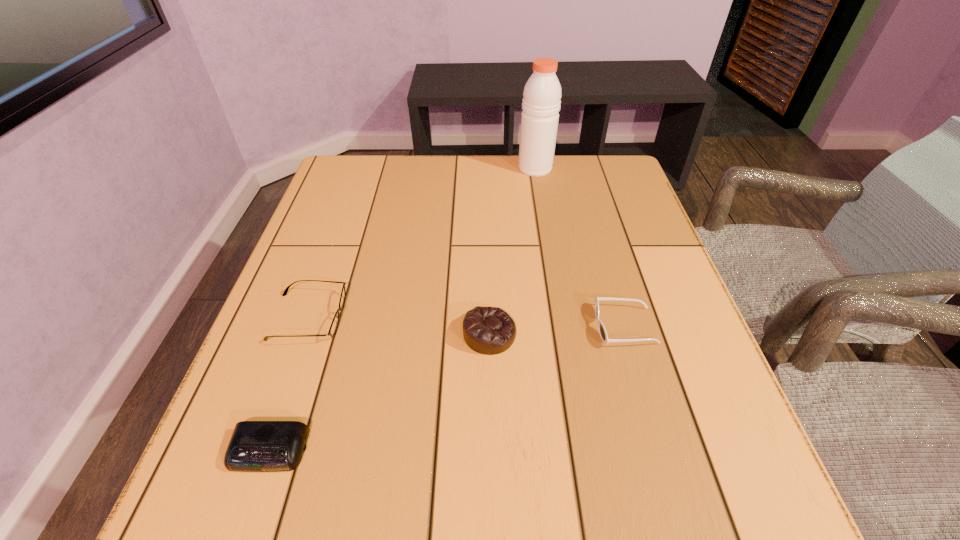
Identify the location of free location located 0.350m with the lenses of the sunglasses facing outward. (418, 326).

I want to click on free space located with the lenses of the sunglasses facing outward, so click(x=484, y=326).

At what (x,y) coordinates should I click in order to perform the action: click on free region located 0.180m on the front-facing side of the spectacles. Please return your answer as a coordinate pair (x, y). This screenshot has height=540, width=960. Looking at the image, I should click on (433, 317).

Locate an element on the screen. object that is at the far edge is located at coordinates tap(541, 100).

Find the location of a particular element. This screenshot has width=960, height=540. object positioned at the near edge is located at coordinates (255, 446).

Image resolution: width=960 pixels, height=540 pixels. In order to click on spectacles that is positioned at the left edge in this screenshot , I will do `click(335, 322)`.

Identify the location of alarm clock present at the left edge. (255, 446).

I want to click on object that is at the right edge, so click(x=602, y=331).

Locate an element on the screen. The width and height of the screenshot is (960, 540). object present at the near left corner is located at coordinates [x=255, y=446].

You are a GUI agent. You are given a task and a screenshot of the screen. Output one action in this format:
    pyautogui.click(x=<x>, y=<y>)
    Task: Click on the blank space at the far edge
    
    Given the screenshot: What is the action you would take?
    pyautogui.click(x=475, y=197)